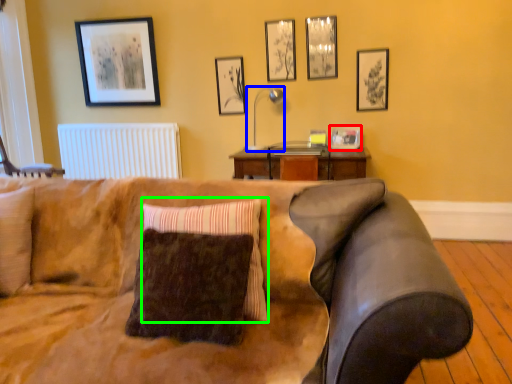
Question: Estimate the real-world distances between objects in this image. Which object is farther from picture frame (highlighted by a red box), lamp (highlighted by a blue box) or pillow (highlighted by a green box)?

Choices:
 (A) lamp
 (B) pillow

Answer: (B)